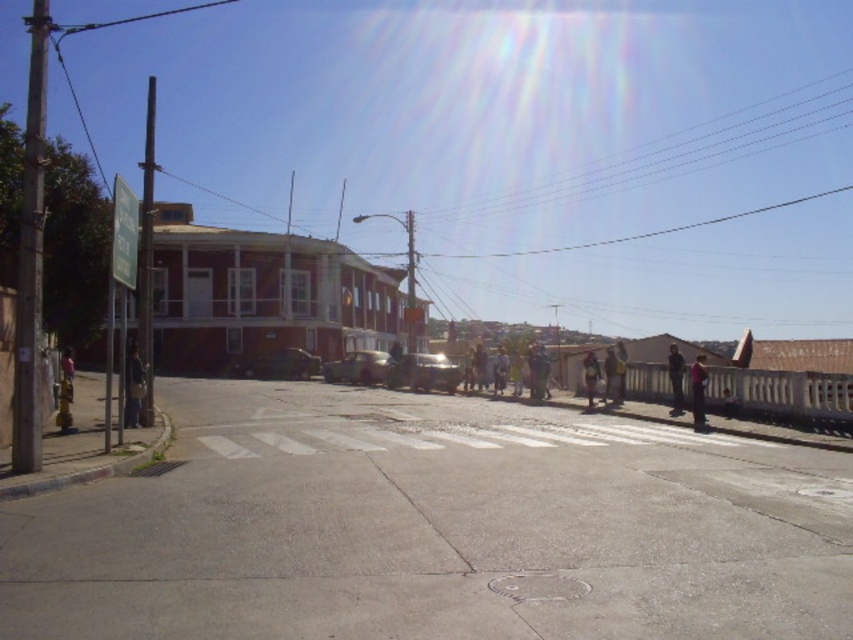
Question: Which point appears farthest from the camera in this image?

Choices:
 (A) (592, 349)
 (B) (672, 392)
 (C) (503, 387)
 (D) (704, 374)

Answer: (A)

Question: Does metallic silver train at center appear on the left side of matte brown jacket at center?

Choices:
 (A) yes
 (B) no

Answer: (A)

Question: Can you confirm if matte black jacket at left is thinner than dark blue jeans at center?

Choices:
 (A) yes
 (B) no

Answer: (A)

Question: Does metallic silver train at center have a larger size compared to dark blue jeans at center?

Choices:
 (A) yes
 (B) no

Answer: (A)

Question: Estimate the real-world distances between objects in this image. Which object is closer to the matte black jacket at left?

Choices:
 (A) metallic silver train at center
 (B) light brown leather jacket at upper right
 (C) dark blue jeans at center

Answer: (C)

Question: Considering the real-world distances, which object is closest to the matte brown jacket at center?

Choices:
 (A) light brown leather jacket at upper right
 (B) dark blue jeans at center
 (C) light brown leather jacket at center

Answer: (A)